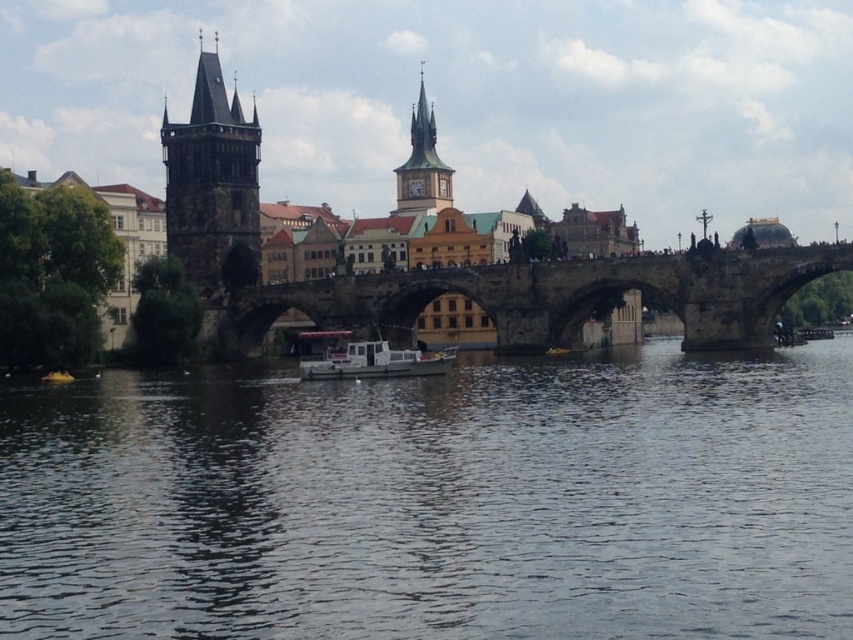
You are standing on the Charles Bridge in Prague and looking at the scene described. There is a point marked at coordinates point [436,500]. What is located at that point?

The point [436,500] indicates dark blue water at center.

You are a tourist standing on the brown stone bridge at center and want to take a photo of the golden stone clock tower at upper center. If your camera has a maximum zoom range of 50 meters, can you capture the tower clearly in your photo?

The brown stone bridge at center and the golden stone clock tower at upper center are 49.27 meters apart from each other. Since the distance is within the camera maximum zoom range of 50 meters, you can capture the tower clearly in your photo.

Based on the photo, you are standing on the Charles Bridge in Prague and want to locate the dark blue water at center. According to the coordinates provided, where should you look relative to your position on the bridge?

The dark blue water at center is located at coordinates point (436, 500), which means it is positioned to the lower right of your current position on the bridge.